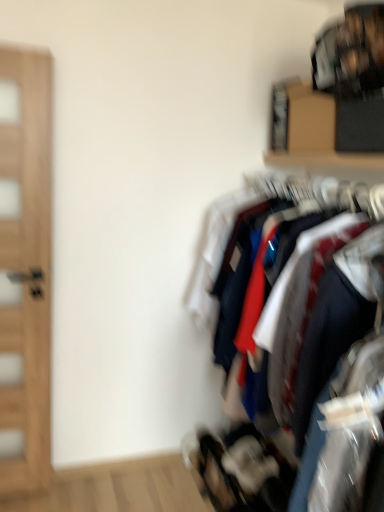
This screenshot has width=384, height=512. What do you see at coordinates (25, 269) in the screenshot?
I see `wooden door at left` at bounding box center [25, 269].

The image size is (384, 512). I want to click on wooden door at left, so click(25, 269).

Where is `wooden door at left`? The width and height of the screenshot is (384, 512). wooden door at left is located at coordinates (25, 269).